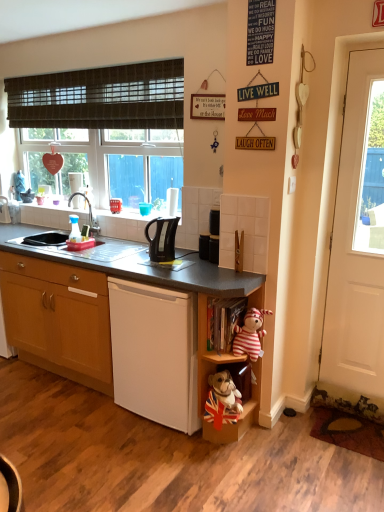
Locate an element on the screen. This screenshot has width=384, height=512. free spot to the right of black plastic kettle at center is located at coordinates (193, 258).